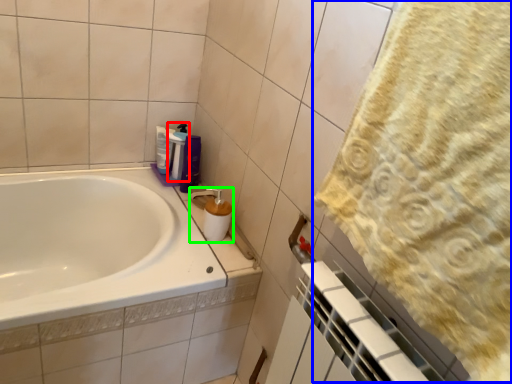
Question: Which is farther away from cleaning product (highlighted by a red box)? bath towel (highlighted by a blue box) or soap dispenser (highlighted by a green box)?

Choices:
 (A) bath towel
 (B) soap dispenser

Answer: (A)